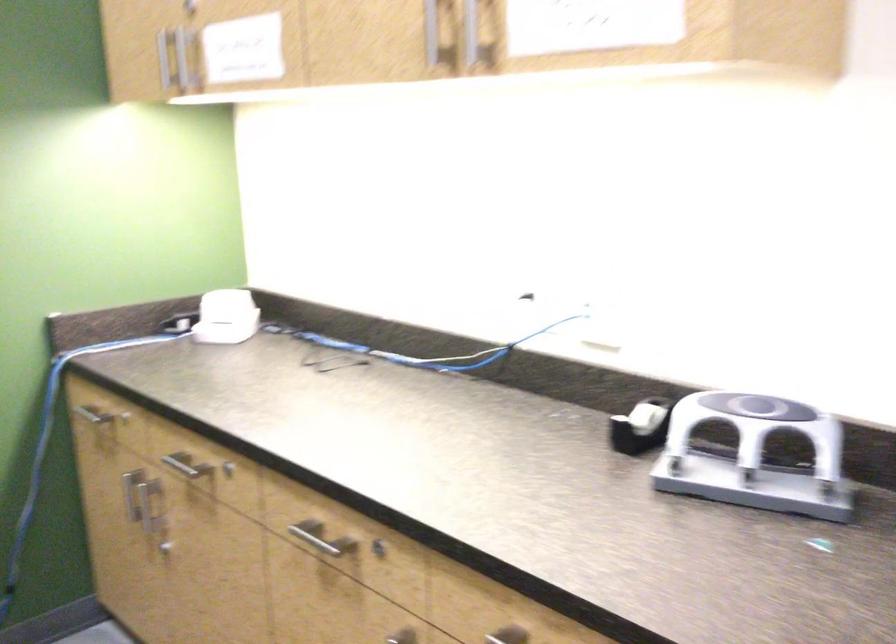
Where would you lift the black tape dispenser? Please return your answer as a coordinate pair (x, y).

(641, 427)